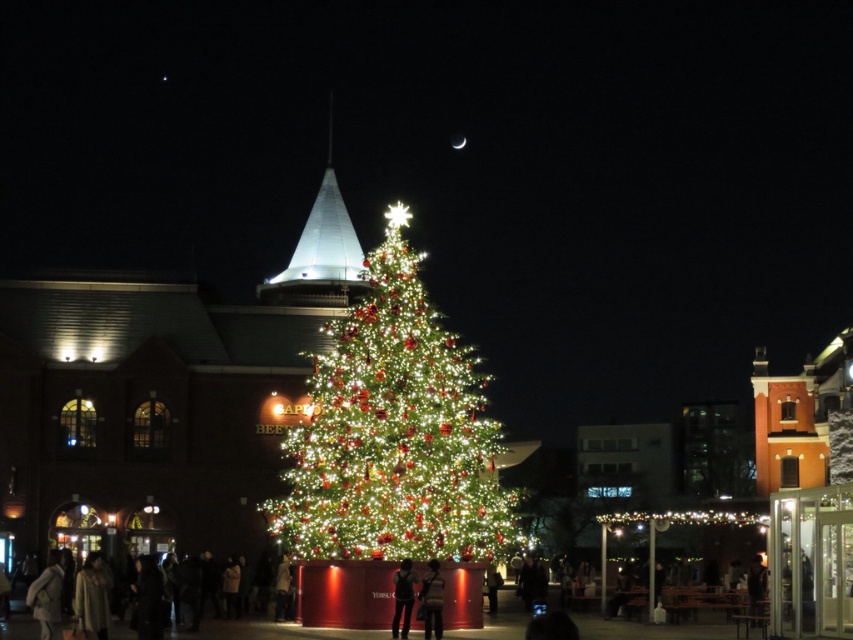
You are attending a Christmas event and notice the white glossy spire at center and the dark clothing at center. Which object is positioned higher in the image?

The white glossy spire at center is located above dark clothing at center, so it is positioned higher in the image.

In the scene shown: You are standing in front of the Christmas tree and want to take a photo of the white glossy spire at center and the dark clothing at center. Which object should you focus on first if you want to ensure both are in focus?

The white glossy spire at center might be wider than dark clothing at center, so you should focus on the white glossy spire at center first to ensure both are in focus.

In the festive nighttime scene with a large illuminated Christmas tree at center and a building with pointed roof in the background, where is the point located at coordinates (393, 433)?

The point at coordinates (393, 433) is located on the illuminated green Christmas tree at center.